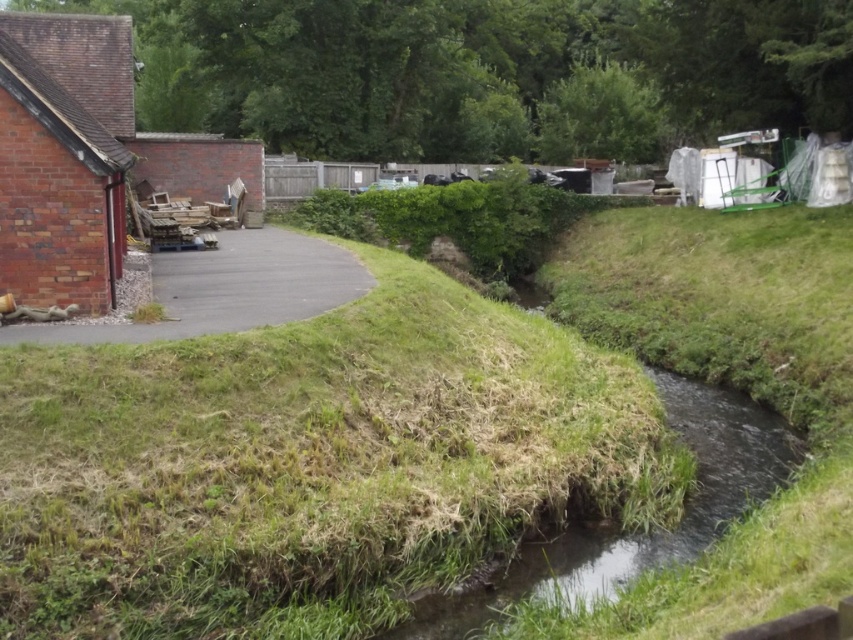
Between point (691, 531) and point (335, 246), which one is positioned behind?

Point (335, 246)

Is green grassy stream at lower right above asphalt road at left?

Actually, green grassy stream at lower right is below asphalt road at left.

Find the location of a particular element. green grassy stream at lower right is located at coordinates (639, 534).

This screenshot has width=853, height=640. I want to click on green grassy stream at lower right, so click(x=639, y=534).

Can you confirm if green grass at center is thinner than asphalt road at left?

Incorrect, green grass at center's width is not less than asphalt road at left's.

Is green grass at center taller than asphalt road at left?

Correct, green grass at center is much taller as asphalt road at left.

Image resolution: width=853 pixels, height=640 pixels. I want to click on green grass at center, so click(x=310, y=465).

This screenshot has height=640, width=853. What do you see at coordinates (310, 465) in the screenshot?
I see `green grass at center` at bounding box center [310, 465].

Who is shorter, green grass at center or green grassy stream at lower right?

Standing shorter between the two is green grassy stream at lower right.

Which is in front, point (392, 508) or point (553, 540)?

Point (392, 508) is in front.

At what (x,y) coordinates should I click in order to perform the action: click on green grass at center. Please return your answer as a coordinate pair (x, y). Image resolution: width=853 pixels, height=640 pixels. Looking at the image, I should click on tap(310, 465).